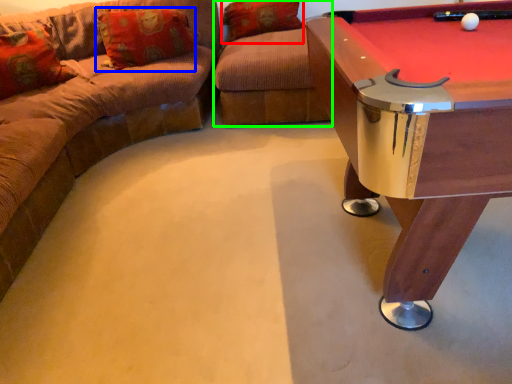
Question: Which object is the farthest from pillow (highlighted by a red box)? Choose among these: pillow (highlighted by a blue box) or swivel chair (highlighted by a green box).

Choices:
 (A) pillow
 (B) swivel chair

Answer: (A)